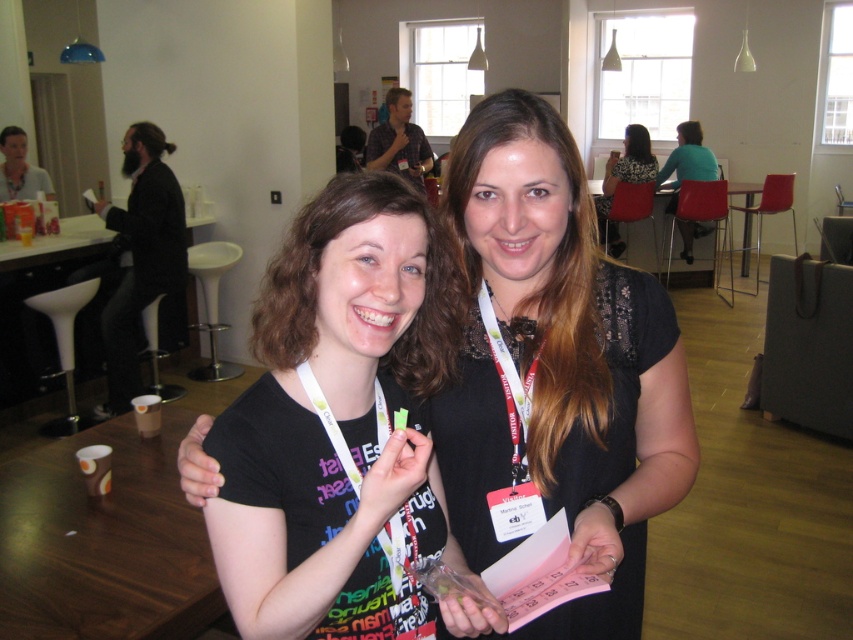
Does black matte t-shirt at center lie behind teal fabric shirt at upper right?

No, black matte t-shirt at center is in front of teal fabric shirt at upper right.

Is black matte t-shirt at center wider than teal fabric shirt at upper right?

No.

Find the location of `black matte t-shirt at center`. black matte t-shirt at center is located at coordinates (335, 417).

Who is more forward, (384, 461) or (207, 413)?

Point (384, 461) is in front.

From the picture: Does black matte t-shirt at center appear under matte black hand at center?

No, black matte t-shirt at center is not below matte black hand at center.

Where is `black matte t-shirt at center`? black matte t-shirt at center is located at coordinates (335, 417).

Can you confirm if black matte t-shirt at center is taller than floral dress at center?

No.

Is black matte t-shirt at center further to camera compared to floral dress at center?

No, black matte t-shirt at center is closer to the viewer.

Which is in front, point (306, 234) or point (642, 134)?

Point (306, 234) is more forward.

What are the coordinates of `black matte t-shirt at center` in the screenshot? It's located at click(335, 417).